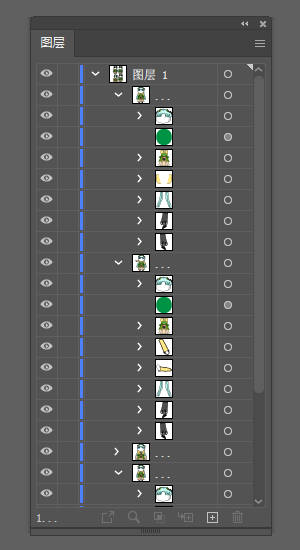
Locate an element on the screen. Image resolution: width=300 pixels, height=550 pixels. columns is located at coordinates (48, 74), (67, 74), (83, 73), (143, 71), (241, 75).